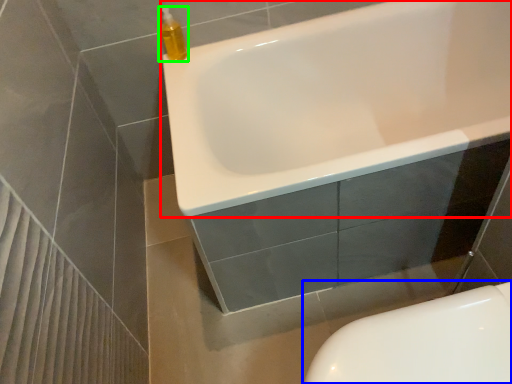
Question: Which is nearer to the bathtub (highlighted by a red box)? toilet (highlighted by a blue box) or cleaning product (highlighted by a green box).

Choices:
 (A) toilet
 (B) cleaning product

Answer: (B)